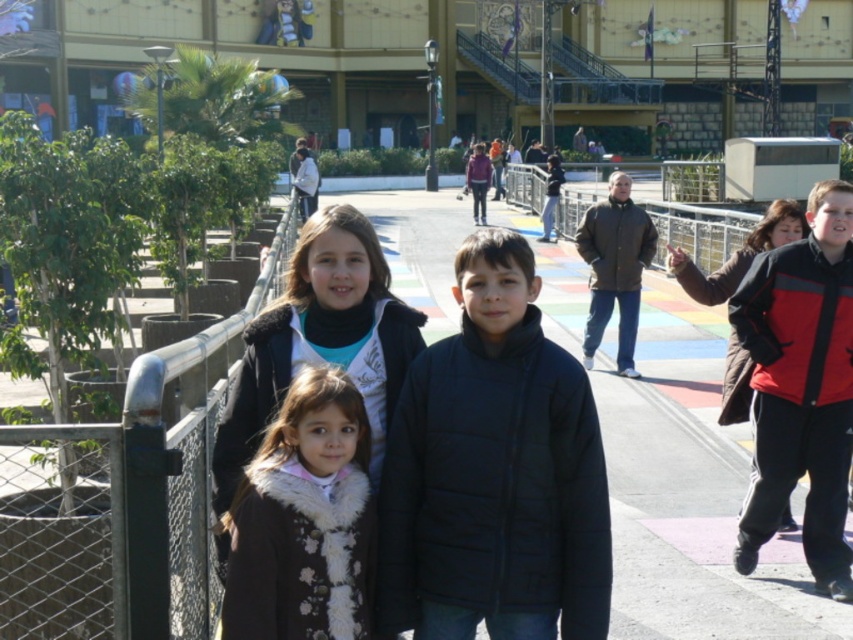
You are a photographer trying to capture a wide shot of the scene. The multicolored painted pavement at center and the white fur coat at center are both in your viewfinder. Given their sizes, which object would require you to zoom out more to ensure it fits entirely within the frame?

The multicolored painted pavement at center requires zooming out more because its width is larger than the white fur coat at center.

You are a photographer trying to capture the children in the scene. The black quilted jacket at center is represented by point (494, 472). Where should you focus your camera to ensure the black quilted jacket at center is in the center of the photo?

You should focus your camera on the coordinates point (494, 472) to ensure the black quilted jacket at center is centered in the photo.

You are a photographer trying to capture a wide shot of the scene. The multicolored painted pavement at center and the white fur coat at center are both in your frame. Considering their sizes, which object would occupy more space in your photo?

The multicolored painted pavement at center has a larger size compared to the white fur coat at center, so it would occupy more space in the photo.